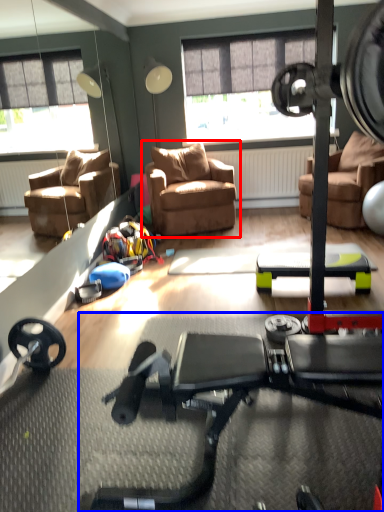
Question: Which object appears closest to the camera in this image, chair (highlighted by a red box) or stationary bicycle (highlighted by a blue box)?

Choices:
 (A) chair
 (B) stationary bicycle

Answer: (B)